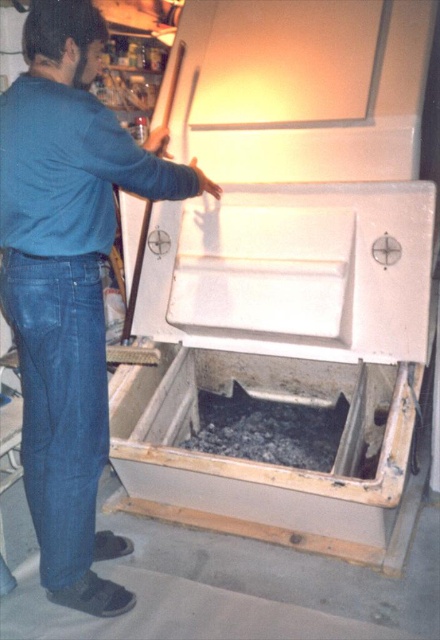
You are a worker who needs to place a small package on the surface where the denim at left and black gravel at lower center are located. Which surface can accommodate the package without it sinking into the material?

The denim at left has a larger size compared to black gravel at lower center, so the package should be placed on the denim at left as it is more stable and less likely to sink compared to the smaller black gravel at lower center.

You are a delivery person trying to place a new package between the white matte washing machine at center and the blue denim jeans at lower left. The package measures 18 inches in length. Can you fit it in the space between them?

The space between the white matte washing machine at center and the blue denim jeans at lower left is 21.16 inches. Since the package is 18 inches long, it can fit within the available space.

You are a maintenance worker who needs to place a 36 inch long tool into the freezer. The tool must be placed horizontally between the denim at left and the black gravel at lower center. Can the tool fit in that space?

The denim at left is 31.68 inches from the black gravel at lower center. Since the tool is 36 inches long, which is longer than the distance between them, the tool cannot fit horizontally in that space.